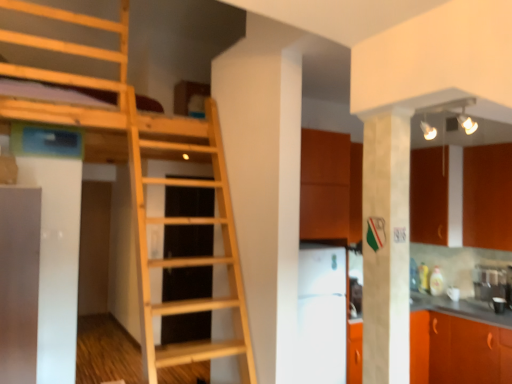
Question: In terms of height, does white glossy refrigerator at center look taller or shorter compared to white marble pillar at center?

Choices:
 (A) short
 (B) tall

Answer: (A)

Question: Is white glossy refrigerator at center bigger or smaller than white marble pillar at center?

Choices:
 (A) big
 (B) small

Answer: (A)

Question: Which object is the farthest from the light wood ladder at center?

Choices:
 (A) white marble pillar at center
 (B) orange matte cabinet at lower right, the first cabinetry in the bottom-to-top sequence
 (C) white glossy refrigerator at center
 (D) orange matte cabinet at right, which is counted as the 1th cabinetry, starting from the top

Answer: (D)

Question: Which object is positioned farthest from the orange matte cabinet at lower right, positioned as the 2th cabinetry in top-to-bottom order?

Choices:
 (A) white glossy refrigerator at center
 (B) white marble pillar at center
 (C) light wood ladder at center
 (D) orange matte cabinet at right, which is counted as the 1th cabinetry, starting from the top

Answer: (C)